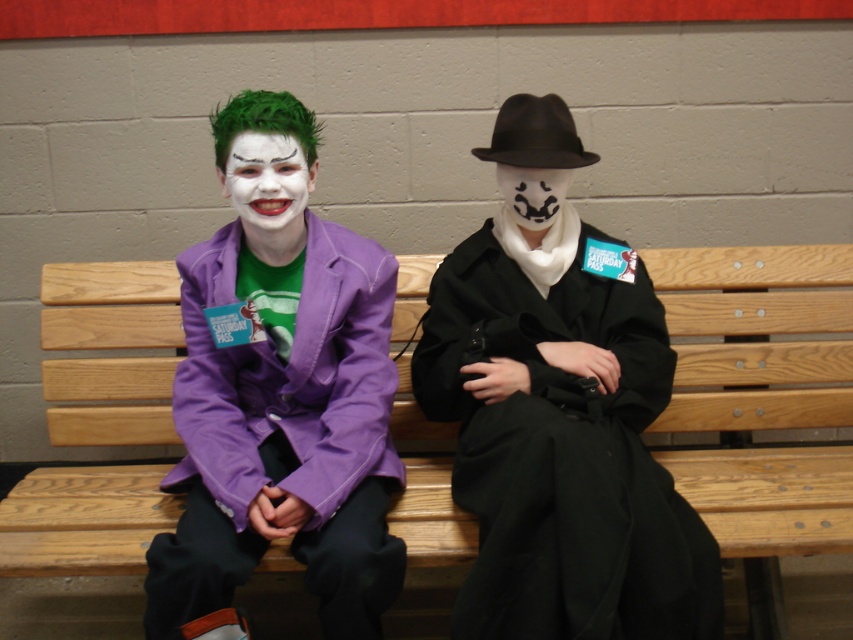
Question: Does matte purple jacket at center have a larger size compared to white matte mask at center?

Choices:
 (A) no
 (B) yes

Answer: (B)

Question: Considering the real-world distances, which object is farthest from the matte white face at center?

Choices:
 (A) matte purple jacket at center
 (B) white matte mask at center

Answer: (B)

Question: Is purple matte jacket at left to the right of white matte mask at center from the viewer's perspective?

Choices:
 (A) yes
 (B) no

Answer: (B)

Question: Which point is farther to the camera?

Choices:
 (A) (534, 323)
 (B) (202, 403)
 (C) (560, 177)

Answer: (C)

Question: Among these objects, which one is nearest to the camera?

Choices:
 (A) matte purple jacket at center
 (B) matte white face at center

Answer: (A)

Question: Is matte purple jacket at center in front of black matte coat at center?

Choices:
 (A) no
 (B) yes

Answer: (A)